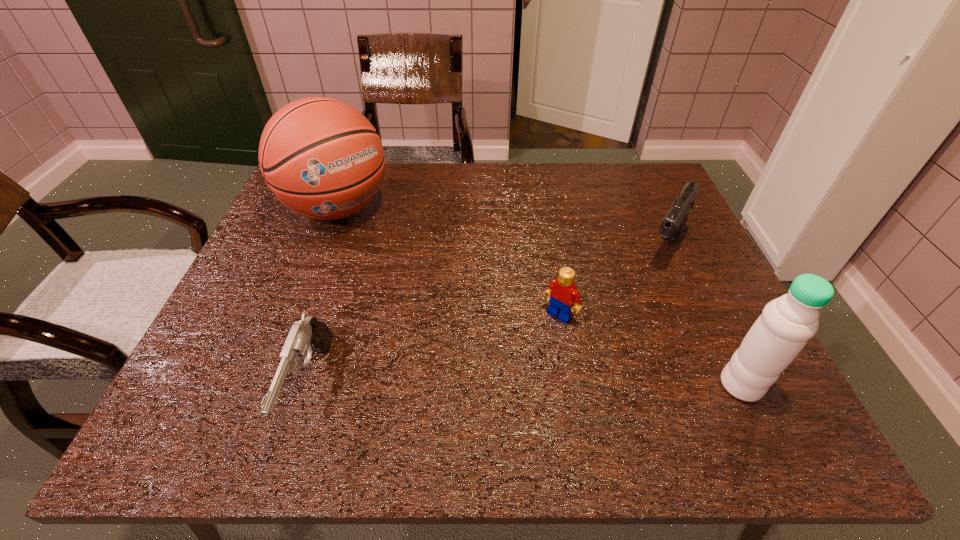
Select which object is the fourth closest to the gun. Please provide its 2D coordinates. Your answer should be formatted as a tuple, i.e. [(x, y)], where the tuple contains the x and y coordinates of a point satisfying the conditions above.

[(786, 324)]

This screenshot has width=960, height=540. I want to click on object identified as the third closest to the gun, so click(672, 225).

Image resolution: width=960 pixels, height=540 pixels. What are the coordinates of `vacant area in the image that satisfies the following two spatial constraints: 1. on the front side of the water bottle; 2. on the right side of the Lego` in the screenshot? It's located at (571, 385).